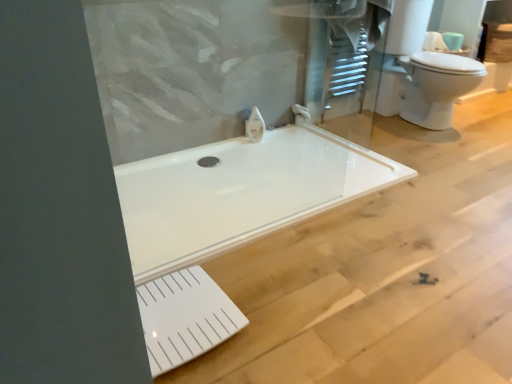
Question: Is white matte toilet paper at upper right inside the boundaries of white glossy toilet at upper right, or outside?

Choices:
 (A) outside
 (B) inside

Answer: (A)

Question: Considering the relative positions of white matte toilet paper at upper right and white glossy toilet at upper right in the image provided, is white matte toilet paper at upper right to the left or to the right of white glossy toilet at upper right?

Choices:
 (A) right
 (B) left

Answer: (A)

Question: Which is farther from the white glossy faucet at upper center, the first faucet in the left-to-right sequence?

Choices:
 (A) white matte toilet paper at upper right
 (B) white glossy faucet at upper center, which ranks as the 1th faucet in right-to-left order
 (C) white glossy toilet at upper right

Answer: (A)

Question: Which object is positioned farthest from the white glossy faucet at upper center, arranged as the first faucet when viewed from the back?

Choices:
 (A) white matte toilet paper at upper right
 (B) white glossy toilet at upper right
 (C) white glossy faucet at upper center, positioned as the second faucet in back-to-front order

Answer: (A)